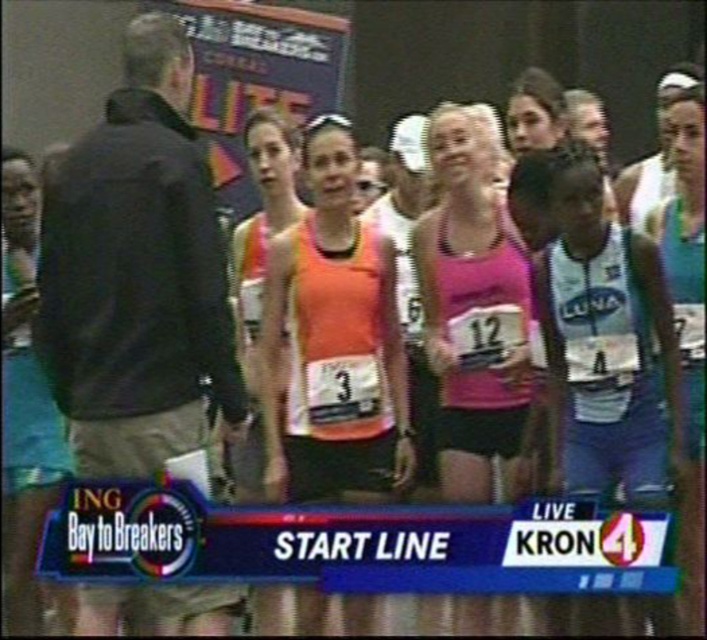
Question: Is orange fabric tank top at center in front of pink fabric tank top at center?

Choices:
 (A) no
 (B) yes

Answer: (B)

Question: Which point is closer to the camera taking this photo?

Choices:
 (A) (21, 612)
 (B) (486, 397)
 (C) (274, 276)
 (D) (670, 564)

Answer: (D)

Question: Is orange fabric tank top at center positioned in front of pink fabric tank top at center?

Choices:
 (A) yes
 (B) no

Answer: (A)

Question: Considering the real-world distances, which object is closest to the pink fabric tank top at center?

Choices:
 (A) orange fabric tank top at center
 (B) blue plastic banner at lower center
 (C) teal fabric shorts at center

Answer: (A)

Question: Can you confirm if blue plastic banner at lower center is positioned below orange fabric tank top at center?

Choices:
 (A) yes
 (B) no

Answer: (A)

Question: Which point is farther to the camera?

Choices:
 (A) teal fabric shorts at center
 (B) orange fabric tank top at center
 (C) pink fabric tank top at center

Answer: (C)